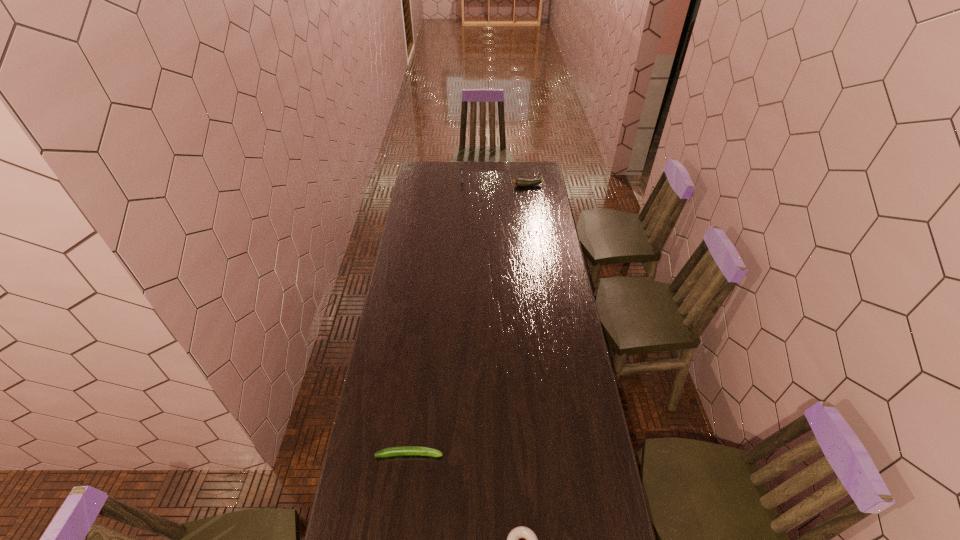
Where is `vacant space in between the shorter zucchini and the igniter`? This screenshot has height=540, width=960. vacant space in between the shorter zucchini and the igniter is located at coordinates (436, 317).

The image size is (960, 540). I want to click on free space that is in between the taller zucchini and the igniter, so click(495, 183).

You are a GUI agent. You are given a task and a screenshot of the screen. Output one action in this format:
    pyautogui.click(x=<x>, y=<y>)
    Task: Click on the object that is the third closest to the igniter
    
    Given the screenshot: What is the action you would take?
    pos(519,532)

Locate an element on the screen. The image size is (960, 540). object that is the second closest to the rightmost object is located at coordinates (400, 450).